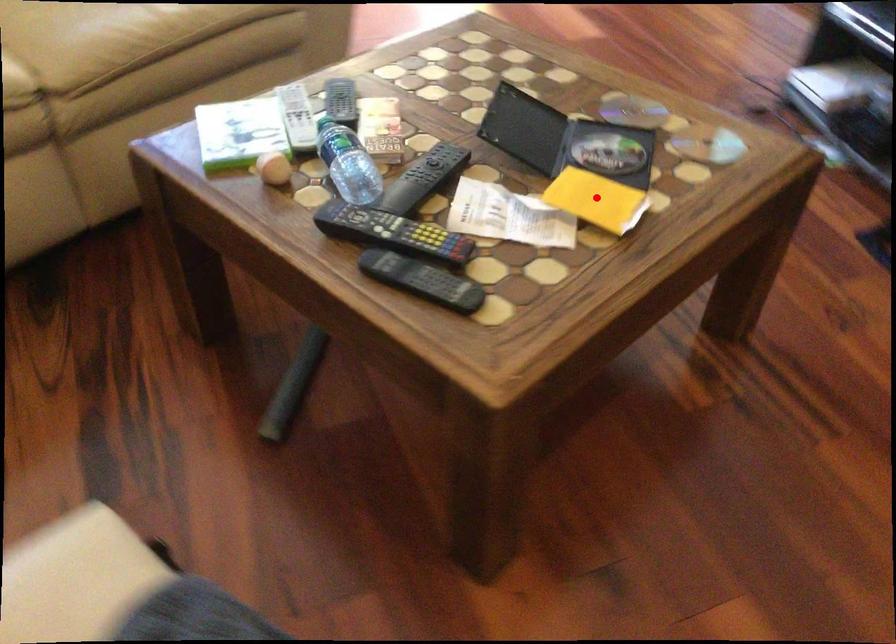
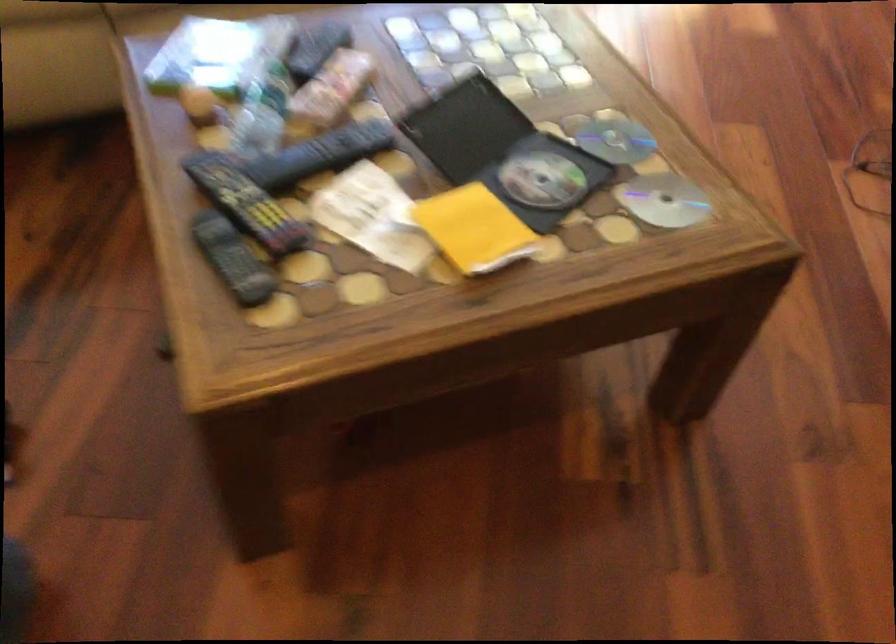
Question: I am providing you with two images of the same scene from different viewpoints. In image1, a red point is highlighted. Considering the same 3D point in image2, which of the following is correct?

Choices:
 (A) It is closer
 (B) It is farther

Answer: (A)